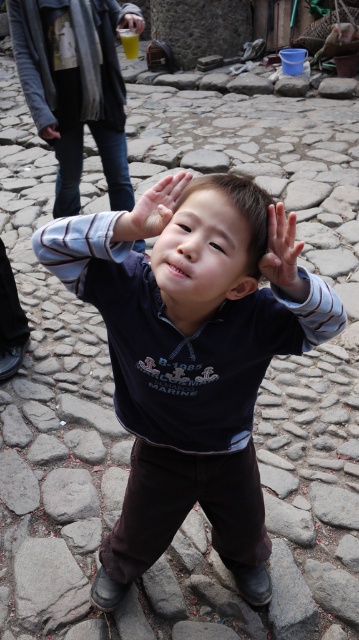
Who is positioned more to the right, gray woolen sweater at upper left or gray rough stone at lower center?

Positioned to the right is gray rough stone at lower center.

Is gray woolen sweater at upper left above gray rough stone at lower center?

Indeed, gray woolen sweater at upper left is positioned over gray rough stone at lower center.

Is point (110, 90) positioned in front of point (63, 493)?

No.

Locate an element on the screen. The image size is (359, 640). gray woolen sweater at upper left is located at coordinates (76, 54).

Between dark blue fleece at center and black matte eye at center, which one appears on the right side from the viewer's perspective?

dark blue fleece at center is more to the right.

Is dark blue fleece at center positioned in front of black matte eye at center?

That is True.

Who is more distant from viewer, (43,259) or (180,230)?

The point (43,259) is behind.

At what (x,y) coordinates should I click in order to perform the action: click on dark blue fleece at center. Please return your answer as a coordinate pair (x, y). Looking at the image, I should click on (188, 369).

Who is positioned more to the left, pale skin hand at center or white matte hand at center?

white matte hand at center

Image resolution: width=359 pixels, height=640 pixels. What do you see at coordinates (281, 250) in the screenshot?
I see `pale skin hand at center` at bounding box center [281, 250].

You are a GUI agent. You are given a task and a screenshot of the screen. Output one action in this format:
    pyautogui.click(x=<x>, y=<y>)
    Task: Click on the pale skin hand at center
    
    Given the screenshot: What is the action you would take?
    pyautogui.click(x=281, y=250)